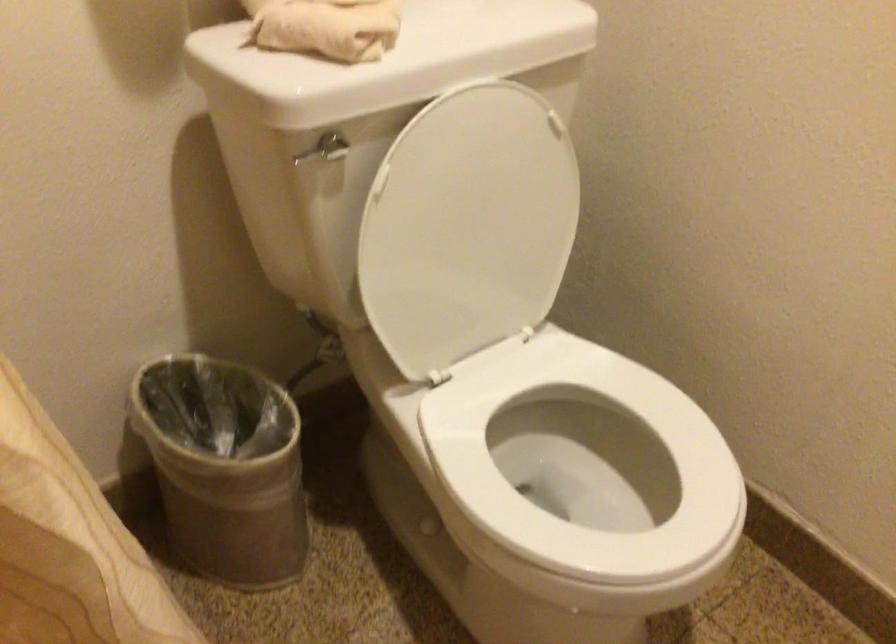
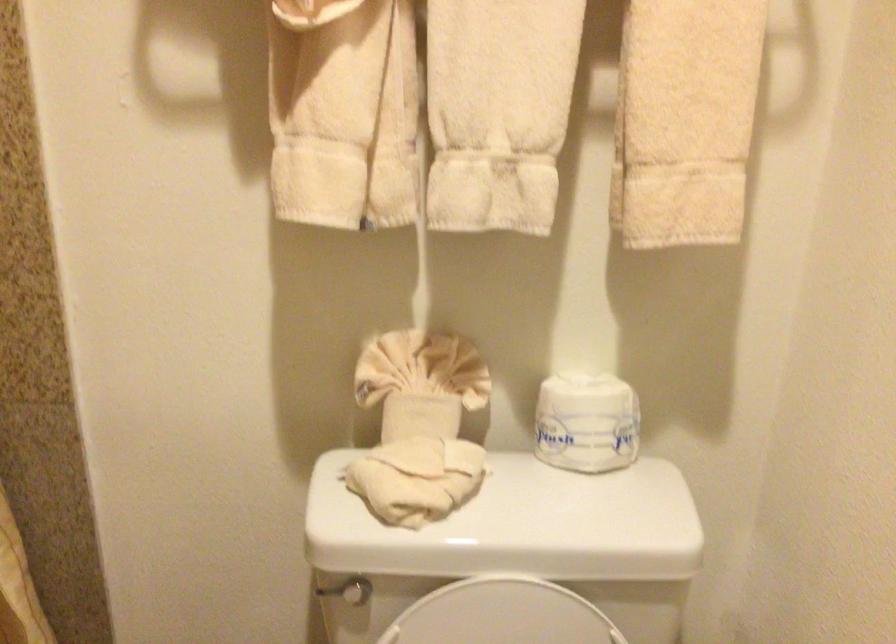
Question: The images are taken continuously from a first-person perspective. In which direction is your viewpoint rotating?

Choices:
 (A) Left
 (B) Right
 (C) Up
 (D) Down

Answer: (A)